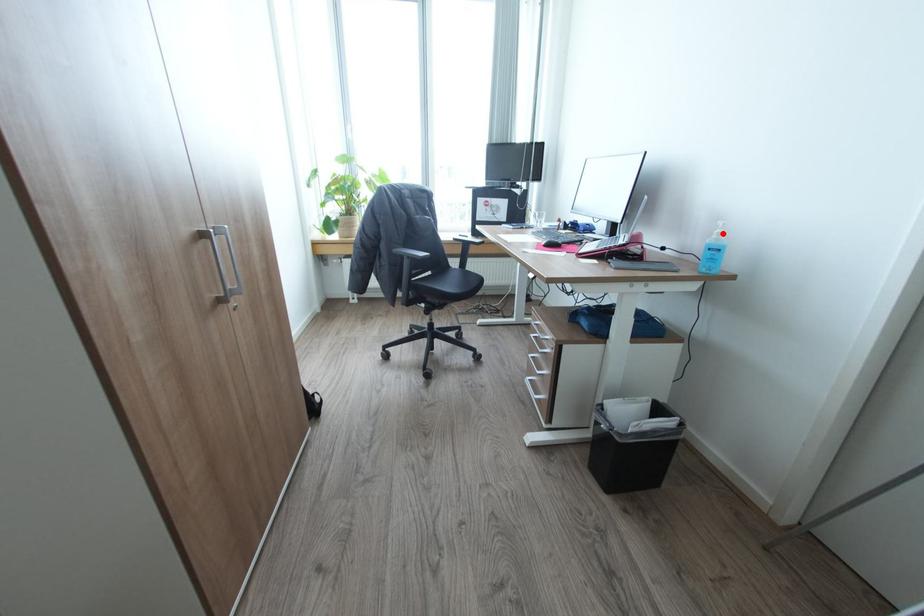
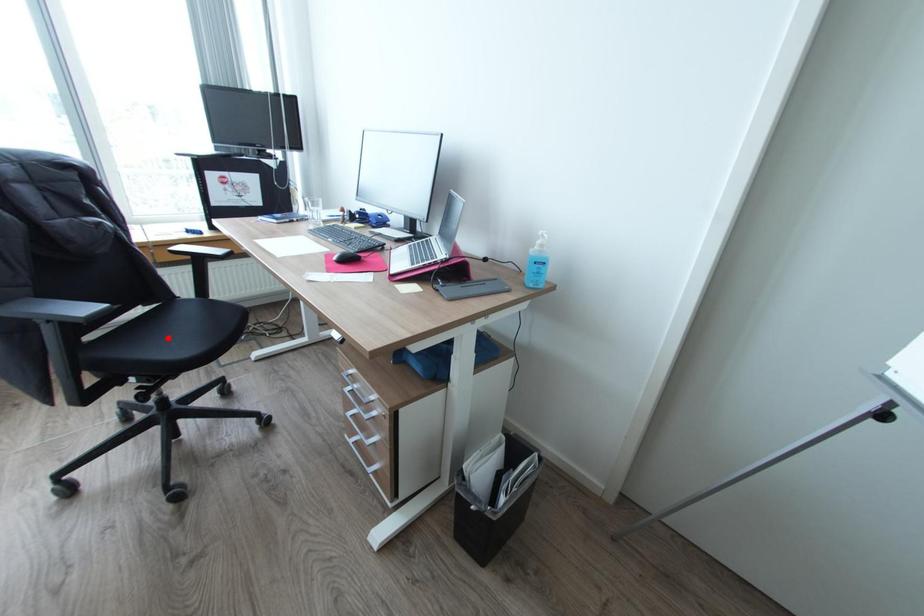
I am providing you with two images of the same scene from different viewpoints. A red point is marked on the first image and another point is marked on the second image. Does the point marked in image1 correspond to the same location as the one in image2?

No